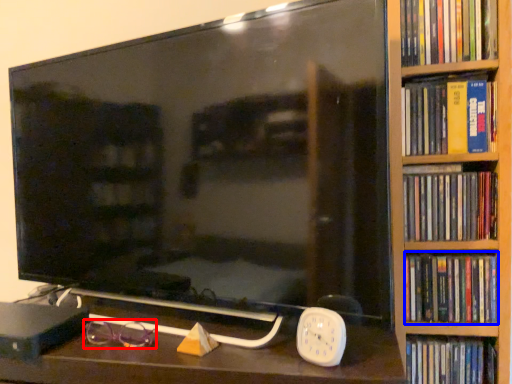
Question: Among these objects, which one is nearest to the camera, glasses (highlighted by a red box) or book (highlighted by a blue box)?

Choices:
 (A) glasses
 (B) book

Answer: (A)